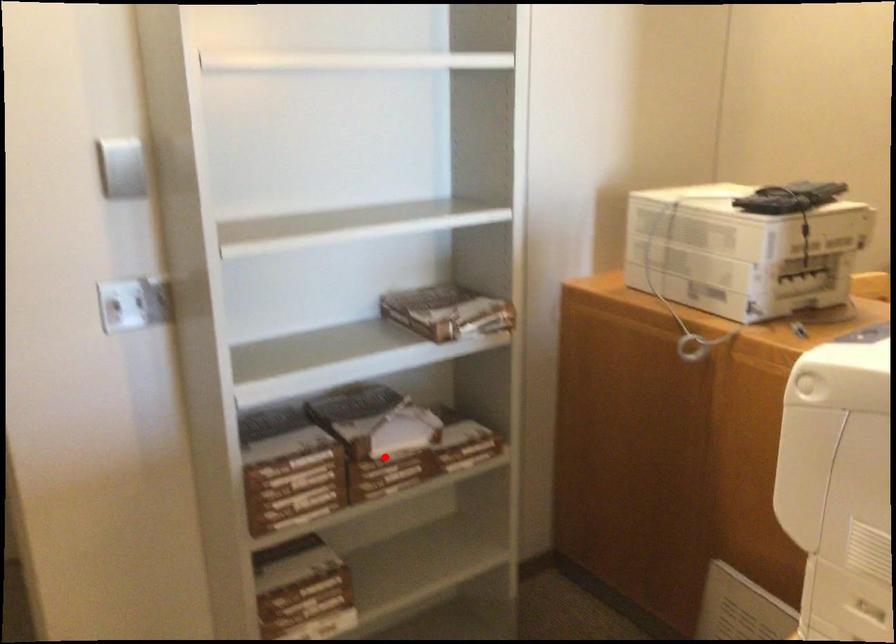
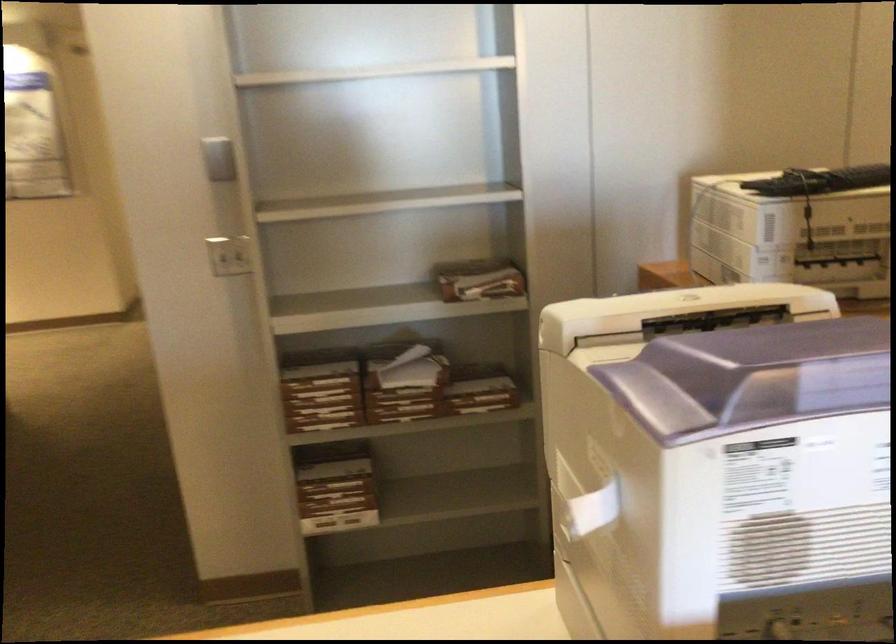
In the second image, find the point that corresponds to the highlighted location in the first image.

(398, 389)